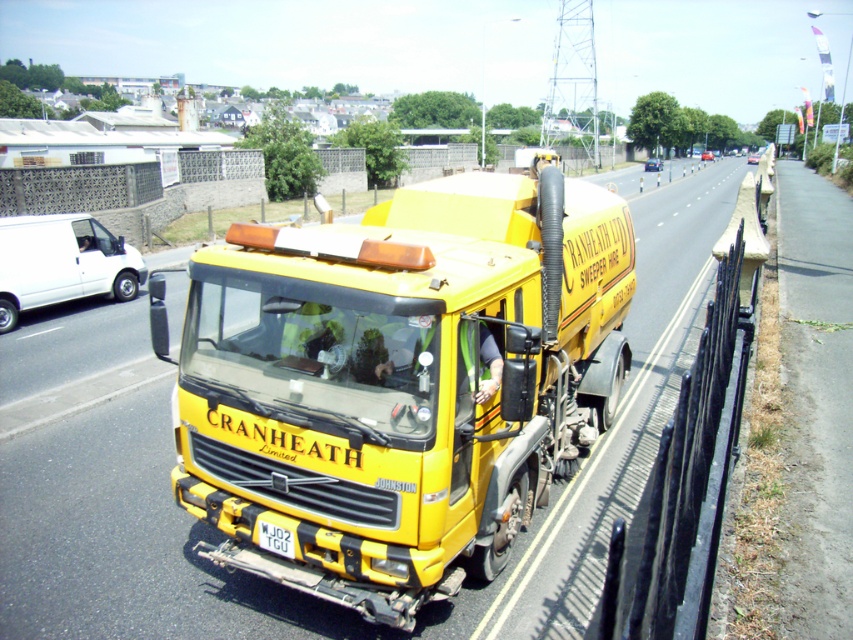
Question: Is yellow matte truck at center below white plastic license plate at center?

Choices:
 (A) no
 (B) yes

Answer: (A)

Question: Which object appears farthest from the camera in this image?

Choices:
 (A) yellow matte truck at center
 (B) white plastic license plate at center

Answer: (B)

Question: Which object appears closest to the camera in this image?

Choices:
 (A) white plastic license plate at center
 (B) yellow matte truck at center

Answer: (B)

Question: Is yellow matte truck at center to the left of white plastic license plate at center from the viewer's perspective?

Choices:
 (A) yes
 (B) no

Answer: (B)

Question: Can you confirm if yellow matte truck at center is positioned to the right of white plastic license plate at center?

Choices:
 (A) no
 (B) yes

Answer: (B)